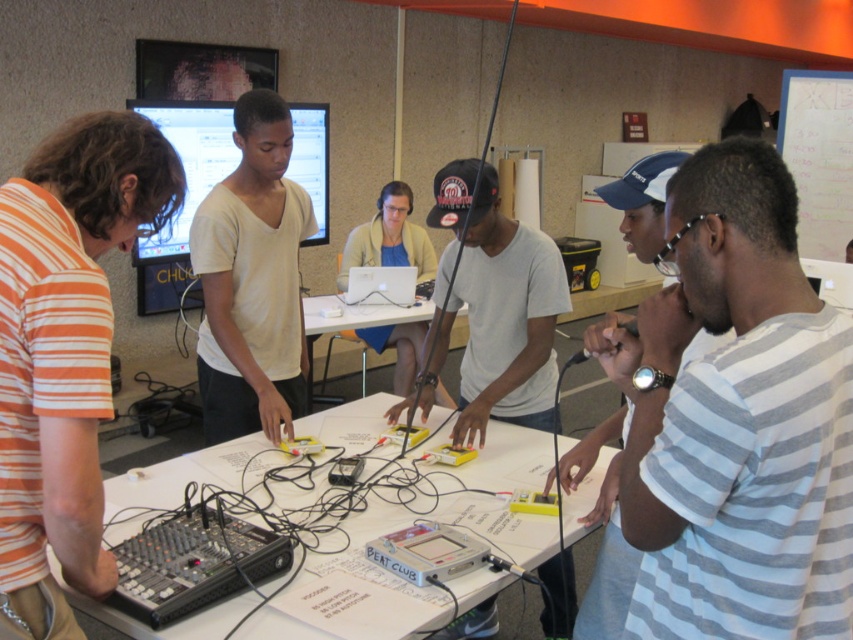
Who is more forward, (82, 429) or (281, 214)?

Answer: Positioned in front is point (82, 429).

Does orange striped shirt at left have a lesser width compared to white matte shirt at center?

Yes, orange striped shirt at left is thinner than white matte shirt at center.

You are a GUI agent. You are given a task and a screenshot of the screen. Output one action in this format:
    pyautogui.click(x=<x>, y=<y>)
    Task: Click on the orange striped shirt at left
    
    Given the screenshot: What is the action you would take?
    (x=65, y=352)

Who is positioned more to the left, white paper at center or silver metallic laptop at center?

silver metallic laptop at center is more to the left.

Does white paper at center come in front of silver metallic laptop at center?

That is True.

Is point (375, 524) closer to viewer compared to point (392, 292)?

Yes, point (375, 524) is closer to viewer.

I want to click on white paper at center, so click(183, 476).

Is point (4, 506) closer to viewer compared to point (509, 465)?

Yes.

Does orange striped shirt at left appear over white paper at center?

Yes, orange striped shirt at left is above white paper at center.

Is point (90, 412) positioned in front of point (355, 432)?

Yes, point (90, 412) is closer to viewer.

The image size is (853, 640). I want to click on orange striped shirt at left, so (65, 352).